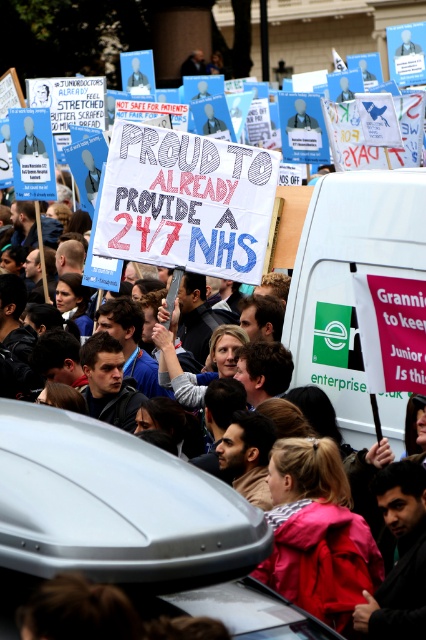
Which is below, white fabric crowd at center or white matte van at center-right?

white fabric crowd at center is below.

Who is higher up, white fabric crowd at center or white matte van at center-right?

Positioned higher is white matte van at center-right.

What do you see at coordinates (123, 515) in the screenshot? I see `white fabric crowd at center` at bounding box center [123, 515].

Where is `white fabric crowd at center`? This screenshot has width=426, height=640. white fabric crowd at center is located at coordinates (123, 515).